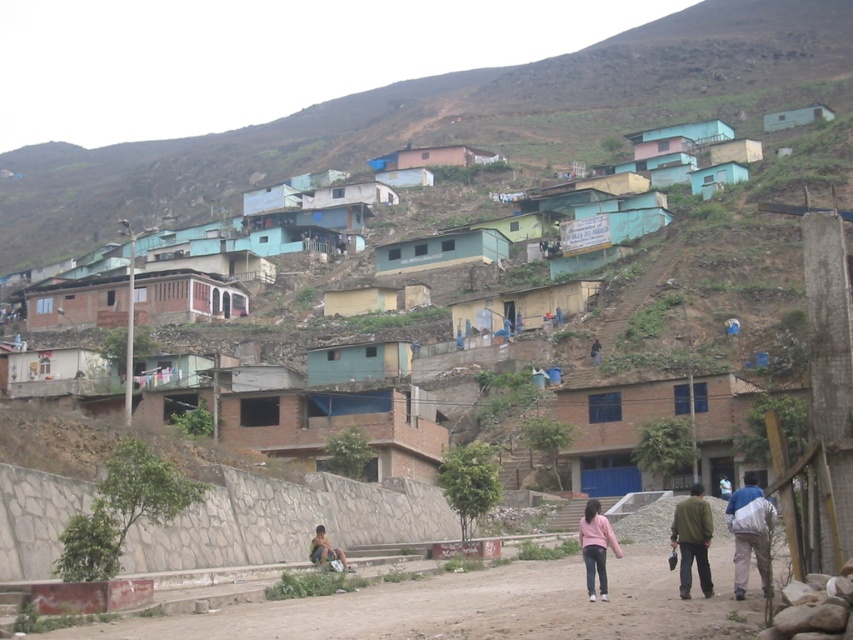
You are planning to install a new solar panel system on the roof of the brick wall house at center and the matte pink building at upper center. Since the solar panels require a minimum of 5 meters in width to be installed properly, can both buildings accommodate the panels based on their widths?

The brick wall house at center has a larger width than the matte pink building at upper center. However, since the exact width measurements are not provided, we cannot definitively determine if either building meets the 5 meter requirement. More information is needed to confirm.

You are a delivery drone with a maximum flight range of 150 meters. You need to deliver a package to the green matte building at center from the blue painted houses at upper center. Can you complete the delivery without recharging?

The distance between the blue painted houses at upper center and the green matte building at center is 126.90 meters, which is within your 150 meter range. Yes, you can complete the delivery without recharging.

Consider the image. You are standing at the base of the hillside settlement and want to reach the matte pink building at upper center. Which direction should you head towards from the brick wall house at center?

You should head upwards from the brick wall house at center because the matte pink building at upper center is located above it.